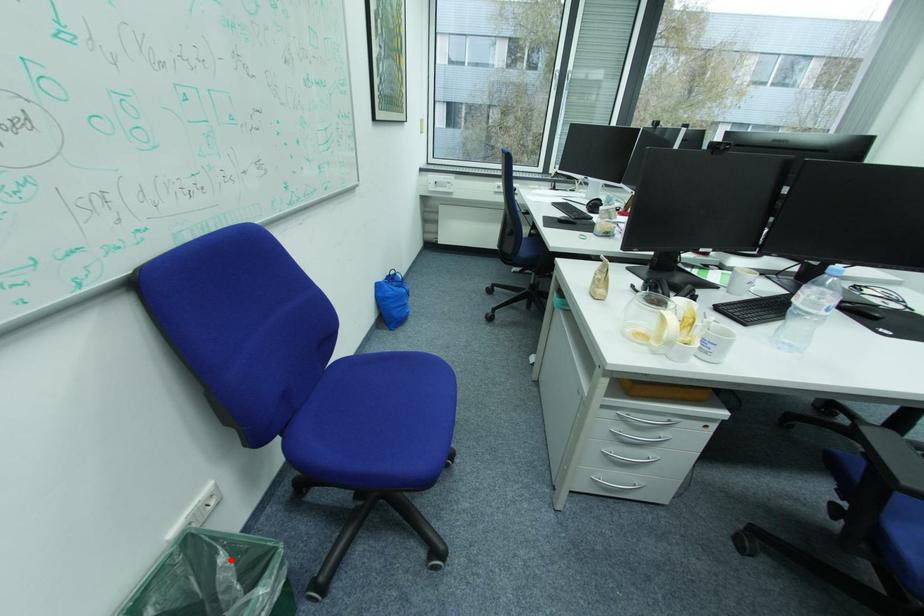
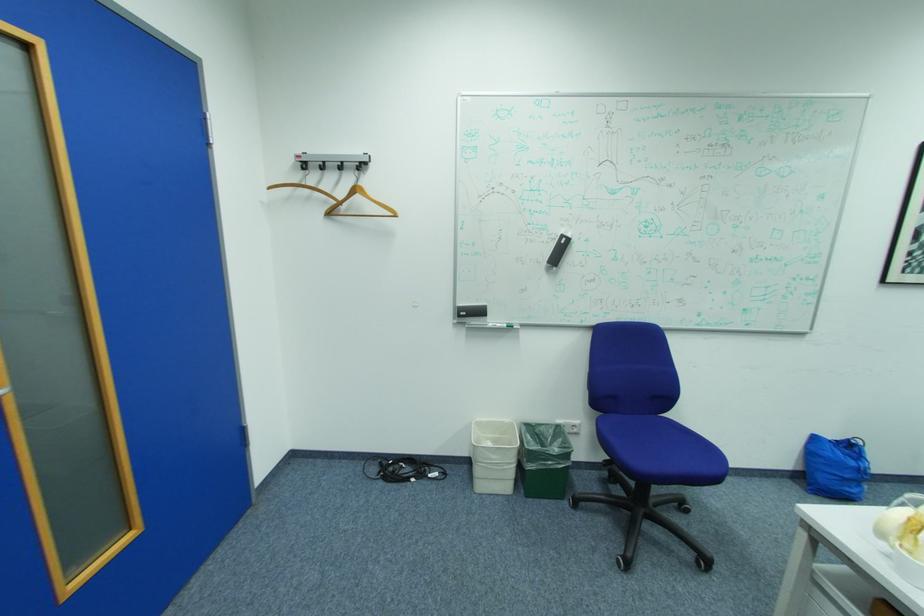
Question: I am providing you with two images of the same scene from different viewpoints. Image1 has a red point marked. In image2, the corresponding 3D location appears at what relative position? Reply with the corresponding letter.

Choices:
 (A) Closer
 (B) Farther

Answer: (B)